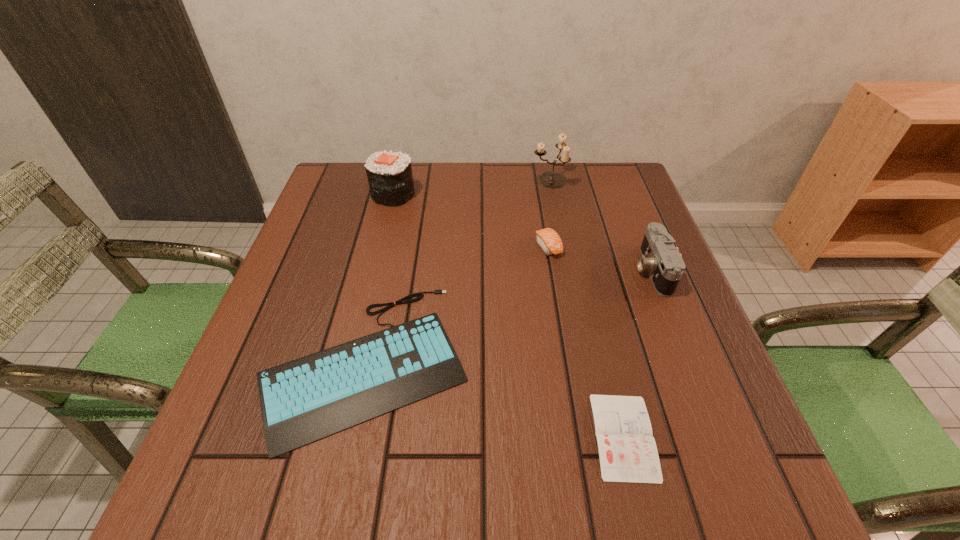
The image size is (960, 540). What are the coordinates of `free region located on the front of the left sushi` in the screenshot? It's located at (387, 221).

The height and width of the screenshot is (540, 960). Find the location of `vacant space located 0.130m on the lens of the camera`. vacant space located 0.130m on the lens of the camera is located at coordinates (579, 270).

Locate an element on the screen. free region located 0.140m on the lens of the camera is located at coordinates (575, 270).

I want to click on free space located 0.170m on the lens of the camera, so click(x=562, y=270).

Identify the location of free space located 0.080m on the left of the right sushi. This screenshot has width=960, height=540. (503, 246).

This screenshot has height=540, width=960. In order to click on blank space located on the right of the fifth tallest object in this screenshot , I will do `click(526, 362)`.

The width and height of the screenshot is (960, 540). What are the coordinates of `free location located on the left of the diary` in the screenshot? It's located at (473, 436).

Image resolution: width=960 pixels, height=540 pixels. I want to click on candle holder located at the far edge, so click(551, 180).

At what (x,y) coordinates should I click in order to perform the action: click on sushi situated at the far edge. Please return your answer as a coordinate pair (x, y). Image resolution: width=960 pixels, height=540 pixels. Looking at the image, I should click on (389, 174).

You are a GUI agent. You are given a task and a screenshot of the screen. Output one action in this format:
    pyautogui.click(x=<x>, y=<y>)
    Task: Click on the computer keyboard that is positioned at the near edge
    
    Given the screenshot: What is the action you would take?
    coord(304,400)